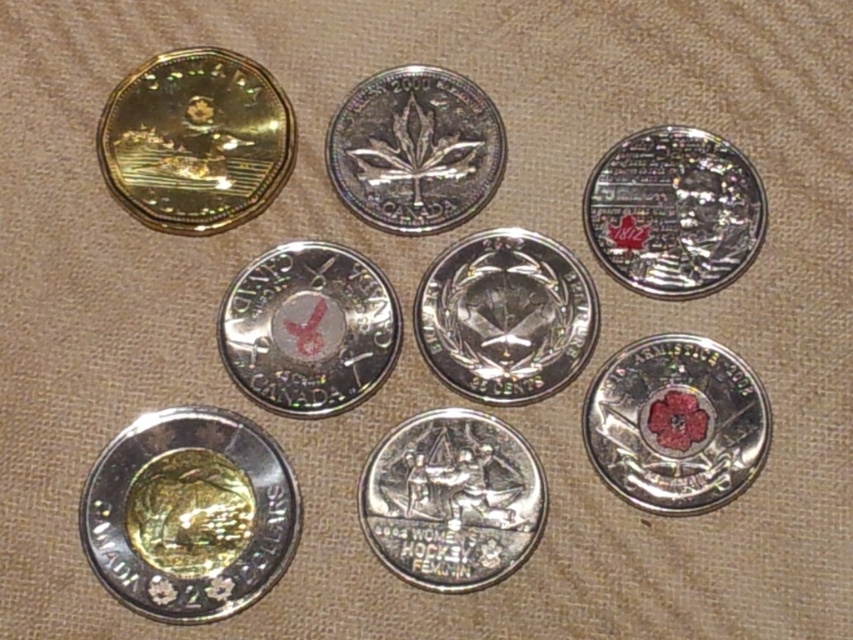
You are looking at the arrangement of Canadian coins on the beige fabric. There are two points marked in the image, one at coordinates point (x=608, y=392) and another at point (x=590, y=173). Which of these points is nearer to you?

Point (x=608, y=392) is closer to the viewer than point (x=590, y=173).

You are organizing Canadian coins on a display table. You have a gold holographic coin at upper left and a glossy silver coin at center. If you want to place a new coin between them, where should you position it?

The gold holographic coin at upper left is positioned over the glossy silver coin at center, so placing a new coin between them would require positioning it below the gold holographic coin at upper left and above the glossy silver coin at center.